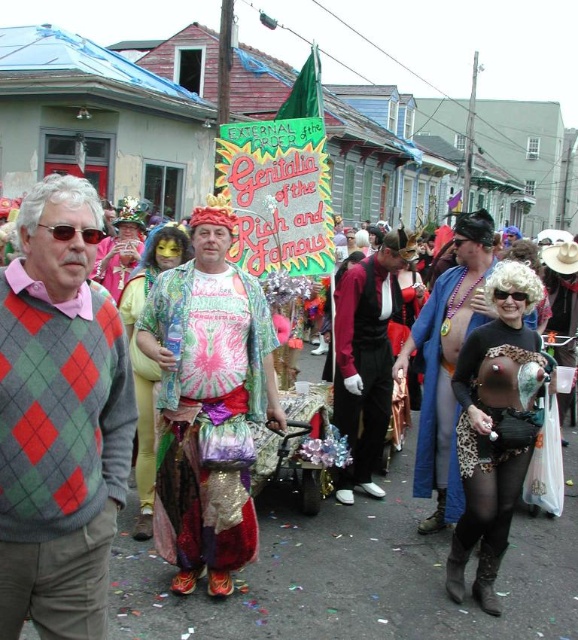
You are a photographer trying to capture a clear shot of the shiny metallic crown at center and the leopard print dress at center. Since the crown is blocking part of the dress, which object should you adjust your focus to ensure the dress is fully visible in the photo?

The shiny metallic crown at center is in front of the leopard print dress at center. To ensure the leopard print dress at center is fully visible, you should move the shiny metallic crown at center out of the way or adjust your angle to avoid the obstruction.

You are a photographer trying to capture the entire scene in one shot. The shiny metallic crown at center and the leopard print dress at center are both in the center. Which object should you adjust your camera angle to prioritize capturing fully if the frame can only accommodate one of them?

The shiny metallic crown at center might be wider than the leopard print dress at center, so you should prioritize capturing the shiny metallic crown at center fully in the frame.